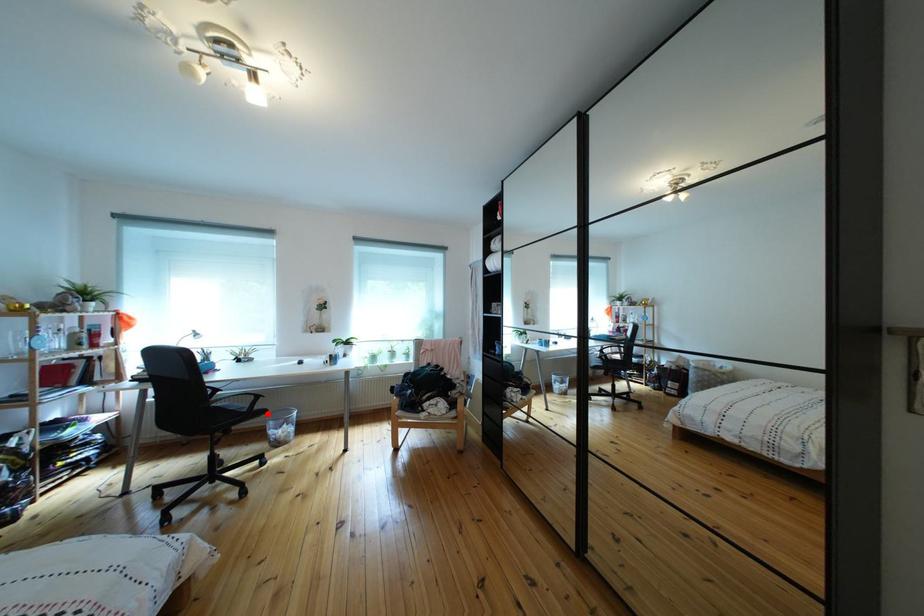
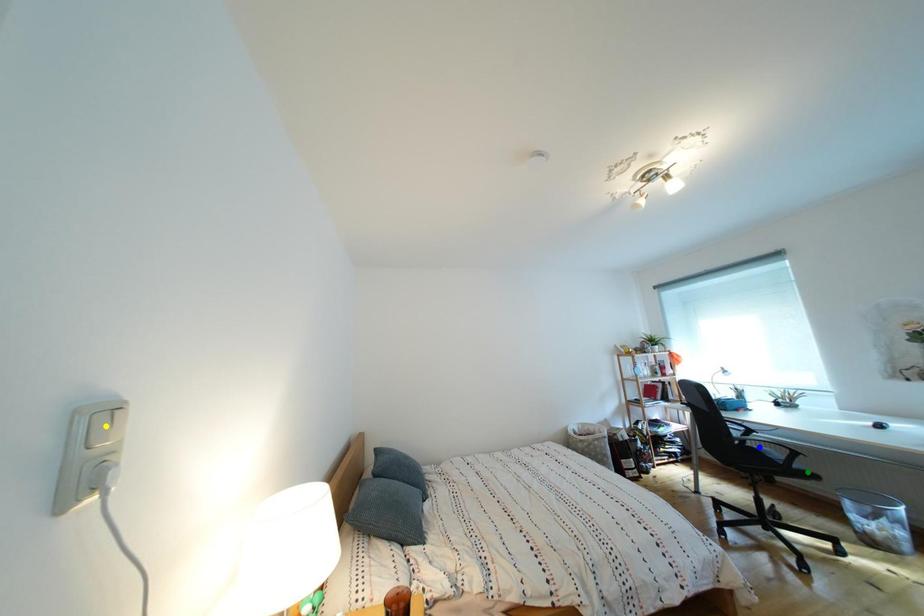
Question: I am providing you with two images of the same scene from different viewpoints. A red point is marked on the first image. You are given multiple points on the second image. Which spot in image 2 lines up with the point in image 1?

Choices:
 (A) green point
 (B) yellow point
 (C) blue point

Answer: (A)